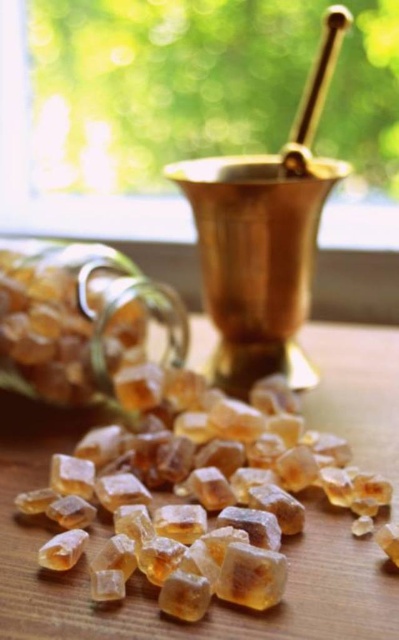
You are an artisan working with the translucent amber crystal at center and the gold metallic mortar at upper center. To grind the crystal, you need to place it into the mortar. Based on their positions, can you move the crystal directly to the mortar without moving any other objects?

The translucent amber crystal at center is to the left of the gold metallic mortar at upper center, so yes, you can move the crystal directly to the mortar without moving other objects since it is already positioned to the left, which is adjacent and accessible.

What are the coordinates of the gold metallic mortar at upper center?

The gold metallic mortar at upper center is located at coordinates point (x=264, y=236).

You are a photographer standing at the camera position. You want to capture a closeup shot of the gold metallic mortar at upper center. Is the mortar within your camera frame?

The gold metallic mortar at upper center is 92.72 centimeters from camera, so it is within the camera frame as it is close enough for a closeup shot.